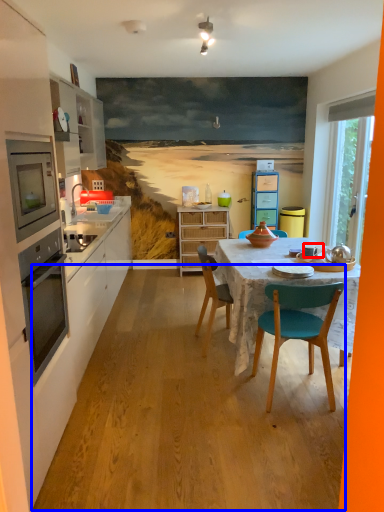
Question: Which object appears closest to the camera in this image, coffee cup (highlighted by a red box) or plywood (highlighted by a blue box)?

Choices:
 (A) coffee cup
 (B) plywood

Answer: (B)